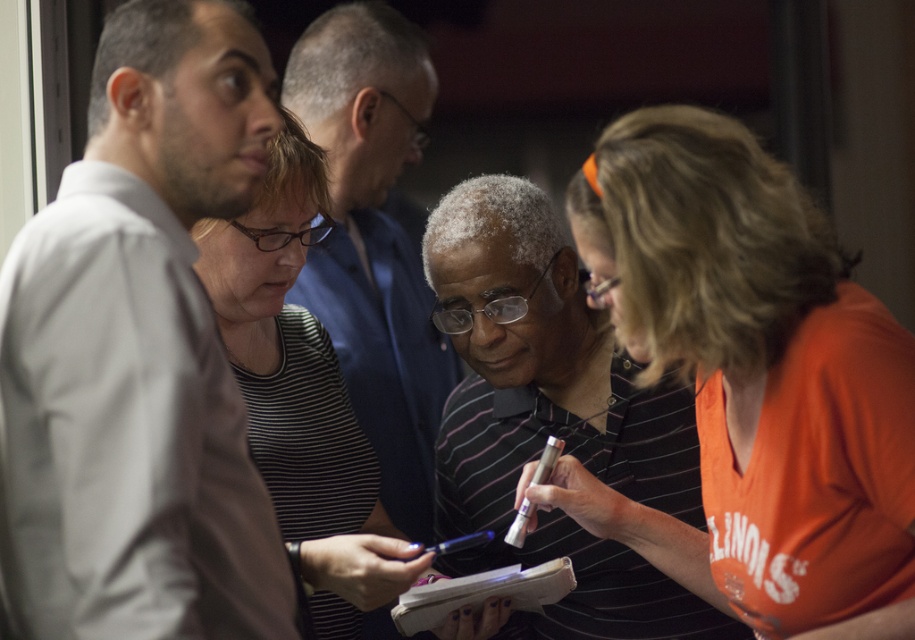
You are standing in front of the group and want to point at both the point at location (717, 410) and the point at location (202, 266) on the table. Which point will appear closer to you?

The point at location (717, 410) is closer to the camera than the point at location (202, 266), so it will appear closer to you.

You are designing a seating arrangement for a workshop and need to ensure there is enough space between the striped polo shirt at center and the striped fabric shirt at center. According to the image, which of these two has a wider width?

The striped polo shirt at center is wider than the striped fabric shirt at center.